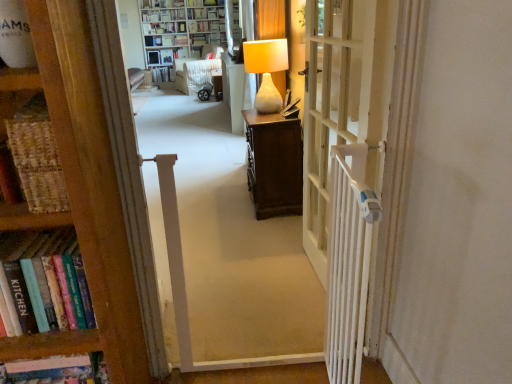
Where is `vacant area to the left of white wooden door at center`? The width and height of the screenshot is (512, 384). vacant area to the left of white wooden door at center is located at coordinates (249, 288).